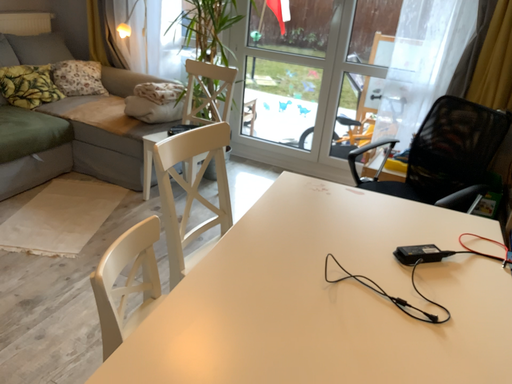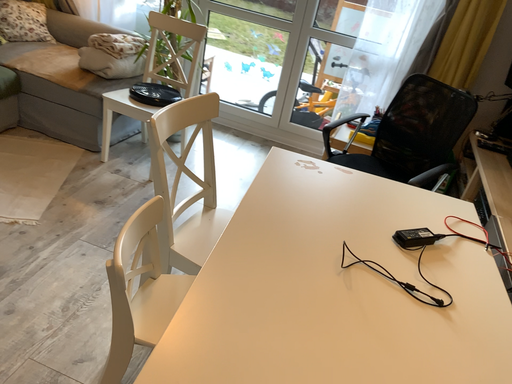
Question: How did the camera likely rotate when shooting the video?

Choices:
 (A) rotated downward
 (B) rotated upward

Answer: (A)